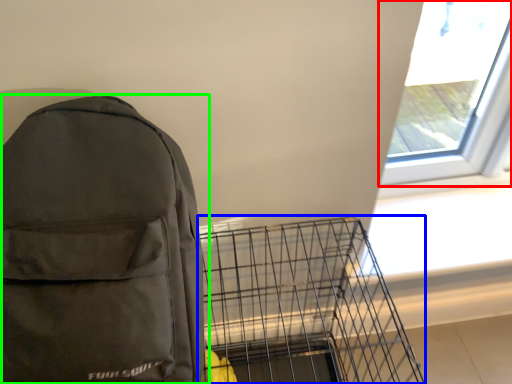
Question: Which object is positioned farthest from window (highlighted by a red box)? Select from bird cage (highlighted by a blue box) and backpack (highlighted by a green box).

Choices:
 (A) bird cage
 (B) backpack

Answer: (B)